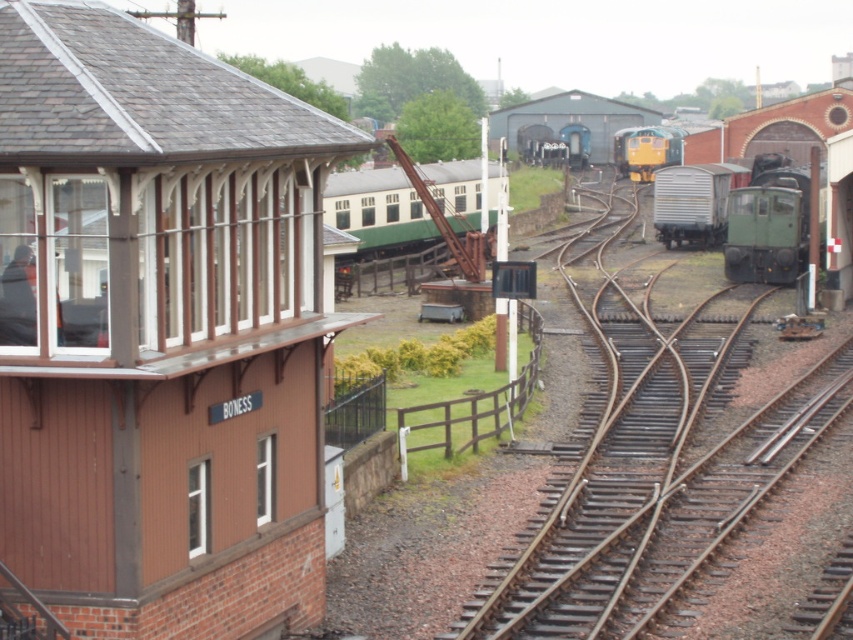
Does silver metallic wagon at center have a greater width compared to yellow/green metal train at center?

Indeed, silver metallic wagon at center has a greater width compared to yellow/green metal train at center.

Between silver metallic wagon at center and yellow/green metal train at center, which one appears on the left side from the viewer's perspective?

Positioned to the left is silver metallic wagon at center.

Between point (683, 179) and point (621, 172), which one is positioned in front?

Positioned in front is point (683, 179).

The image size is (853, 640). I want to click on silver metallic wagon at center, so click(694, 202).

Can you confirm if green matte train at center-right is positioned to the left of yellow/green metal train at center?

Correct, you'll find green matte train at center-right to the left of yellow/green metal train at center.

Can you confirm if green matte train at center-right is positioned below yellow/green metal train at center?

Yes, green matte train at center-right is below yellow/green metal train at center.

Does point (801, 204) lie behind point (648, 145)?

No, (801, 204) is in front of (648, 145).

The height and width of the screenshot is (640, 853). Find the location of `green matte train at center-right`. green matte train at center-right is located at coordinates (769, 224).

Can you confirm if brown metal train track at center is wider than yellow/green metal train at center?

Correct, the width of brown metal train track at center exceeds that of yellow/green metal train at center.

Is point (550, 529) less distant than point (657, 157)?

That is True.

The image size is (853, 640). What are the coordinates of `brown metal train track at center` in the screenshot? It's located at (643, 481).